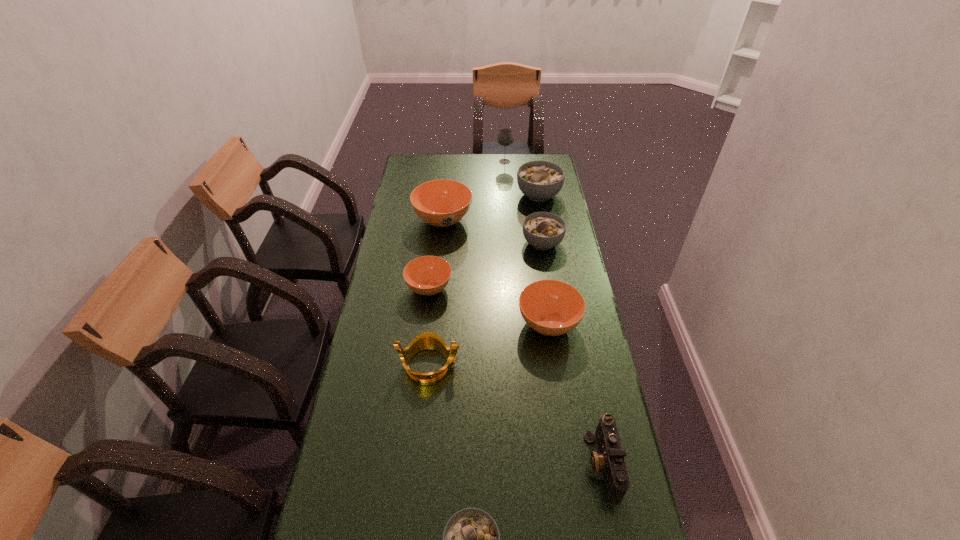
This screenshot has height=540, width=960. Find the location of `blank space that satisfies the following two spatial constraints: 1. on the front side of the second biggest peach soup bowl; 2. at the front emblem of the gold tiara`. blank space that satisfies the following two spatial constraints: 1. on the front side of the second biggest peach soup bowl; 2. at the front emblem of the gold tiara is located at coordinates (555, 364).